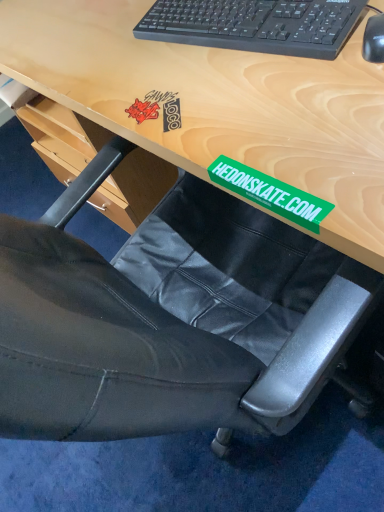
Question: From a real-world perspective, is black plastic keyboard at upper center under black plastic mouse at upper right?

Choices:
 (A) no
 (B) yes

Answer: (A)

Question: Would you say black plastic mouse at upper right is part of black plastic keyboard at upper center's contents?

Choices:
 (A) yes
 (B) no

Answer: (B)

Question: Is black plastic keyboard at upper center oriented away from black plastic mouse at upper right?

Choices:
 (A) yes
 (B) no

Answer: (B)

Question: Is black plastic keyboard at upper center aimed at black plastic mouse at upper right?

Choices:
 (A) yes
 (B) no

Answer: (B)

Question: From the image's perspective, is black plastic keyboard at upper center on black plastic mouse at upper right?

Choices:
 (A) no
 (B) yes

Answer: (B)

Question: Is black plastic keyboard at upper center taller than black plastic mouse at upper right?

Choices:
 (A) no
 (B) yes

Answer: (B)

Question: Can you confirm if black plastic mouse at upper right is bigger than black plastic keyboard at upper center?

Choices:
 (A) no
 (B) yes

Answer: (A)

Question: From the image's perspective, is black plastic mouse at upper right below black plastic keyboard at upper center?

Choices:
 (A) yes
 (B) no

Answer: (A)

Question: Can you confirm if black plastic mouse at upper right is positioned to the right of black plastic keyboard at upper center?

Choices:
 (A) yes
 (B) no

Answer: (A)

Question: Does black plastic mouse at upper right have a greater width compared to black plastic keyboard at upper center?

Choices:
 (A) no
 (B) yes

Answer: (A)

Question: Is black plastic keyboard at upper center located within black plastic mouse at upper right?

Choices:
 (A) no
 (B) yes

Answer: (A)

Question: From a real-world perspective, does black plastic mouse at upper right sit lower than black plastic keyboard at upper center?

Choices:
 (A) no
 (B) yes

Answer: (B)

Question: In terms of width, does black plastic mouse at upper right look wider or thinner when compared to black plastic keyboard at upper center?

Choices:
 (A) wide
 (B) thin

Answer: (B)